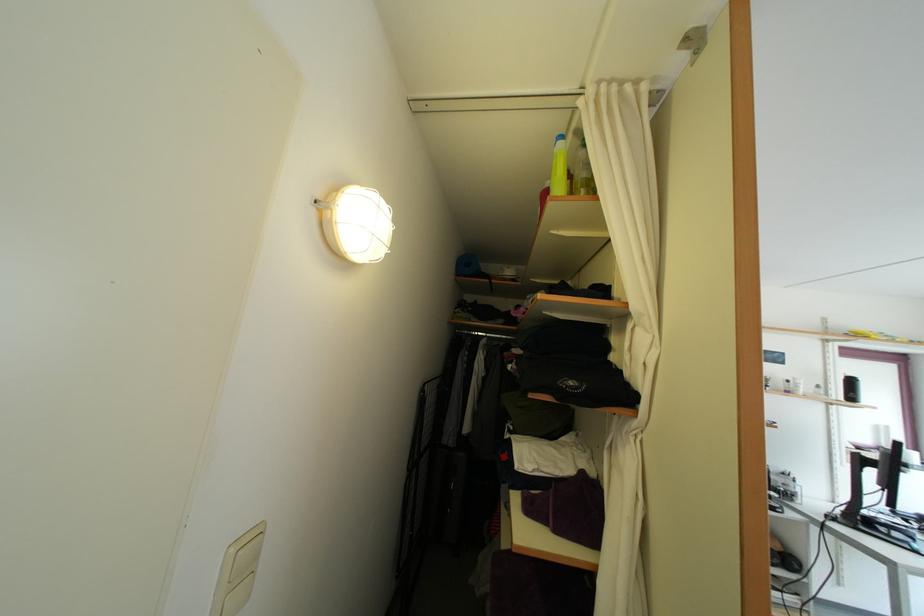
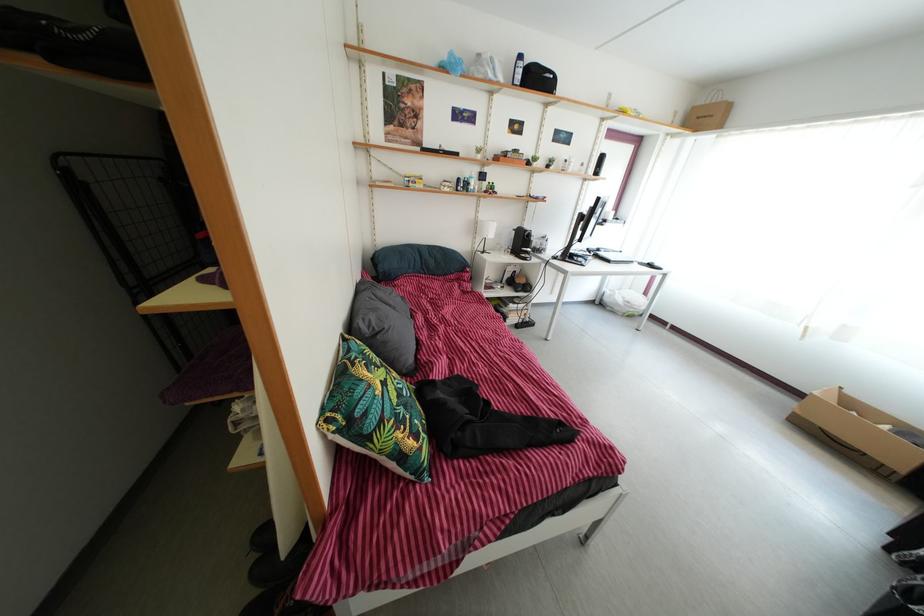
The images are taken continuously from a first-person perspective. In which direction is your viewpoint rotating?

The camera's rotation is toward right-down.